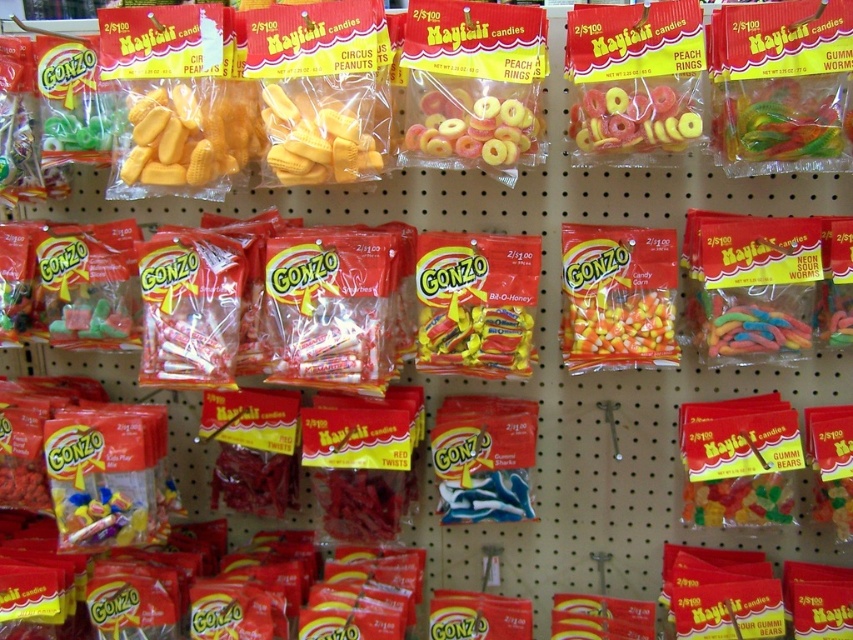
Question: Does translucent rubber rings at center have a lesser width compared to yellow rubber gummy at center?

Choices:
 (A) no
 (B) yes

Answer: (A)

Question: Is translucent rubber gummy worms at upper right to the right of translucent pink rings at center from the viewer's perspective?

Choices:
 (A) no
 (B) yes

Answer: (B)

Question: Can you confirm if translucent rubber gummy worms at upper right is wider than translucent pink rings at center?

Choices:
 (A) yes
 (B) no

Answer: (A)

Question: Among these points, which one is farthest from the camera?

Choices:
 (A) (456, 102)
 (B) (201, 179)
 (C) (815, 163)

Answer: (B)

Question: Among these objects, which one is farthest from the camera?

Choices:
 (A) yellow matte candy corn at center
 (B) yellow rubber gummy at center

Answer: (A)

Question: Which point is farther from the camera taking this photo?

Choices:
 (A) (432, 120)
 (B) (206, 115)
 (C) (842, 163)
 (D) (598, 120)

Answer: (A)